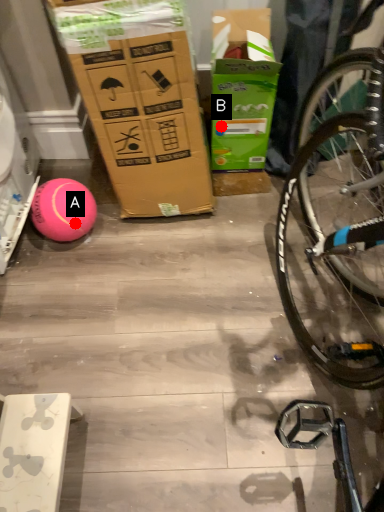
Question: Two points are circled on the image, labeled by A and B beside each circle. Which point is closer to the camera?

Choices:
 (A) A is closer
 (B) B is closer

Answer: (A)